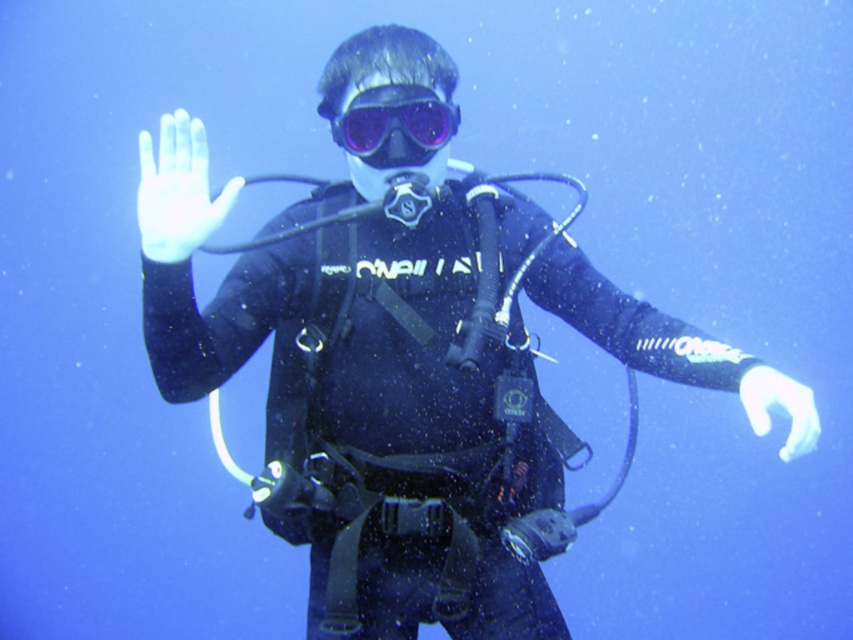
You are an underwater photographer who needs to take a photo of the transparent rubber mask at center. Your camera is located somewhere in the scene. Can you reach the mask with your camera without moving your body? Please explain your reasoning.

The transparent rubber mask at center and camera are 1.67 meters apart. Since the distance between them is 1.67 meters, which is relatively far, you would likely need to move closer or adjust your position to capture a clear photo without moving your body. However, if your camera has a zoom lens capable of focusing at that distance, you might be able to take the photo without moving.